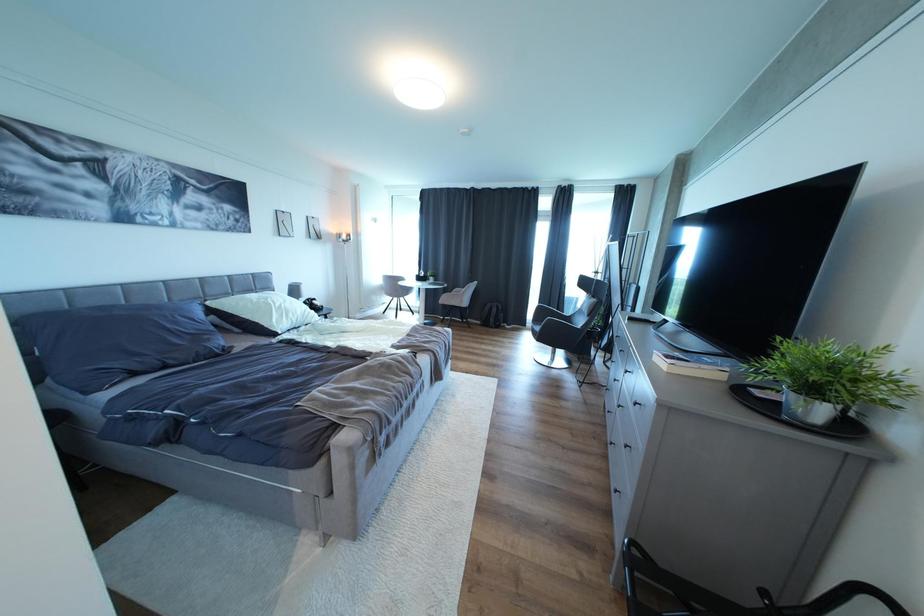
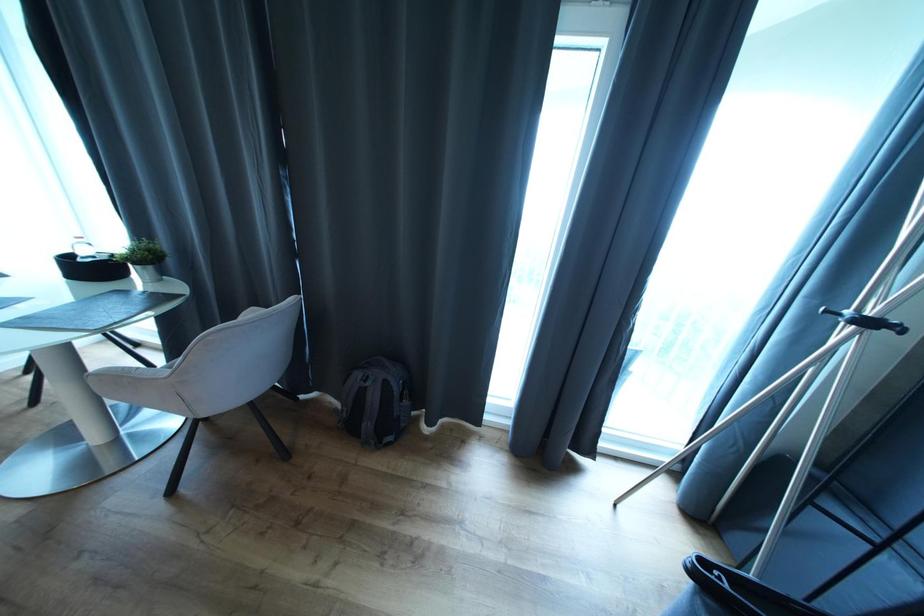
Question: The images are taken continuously from a first-person perspective. In which direction are you moving?

Choices:
 (A) Left
 (B) Right
 (C) Forward
 (D) Backward

Answer: (C)